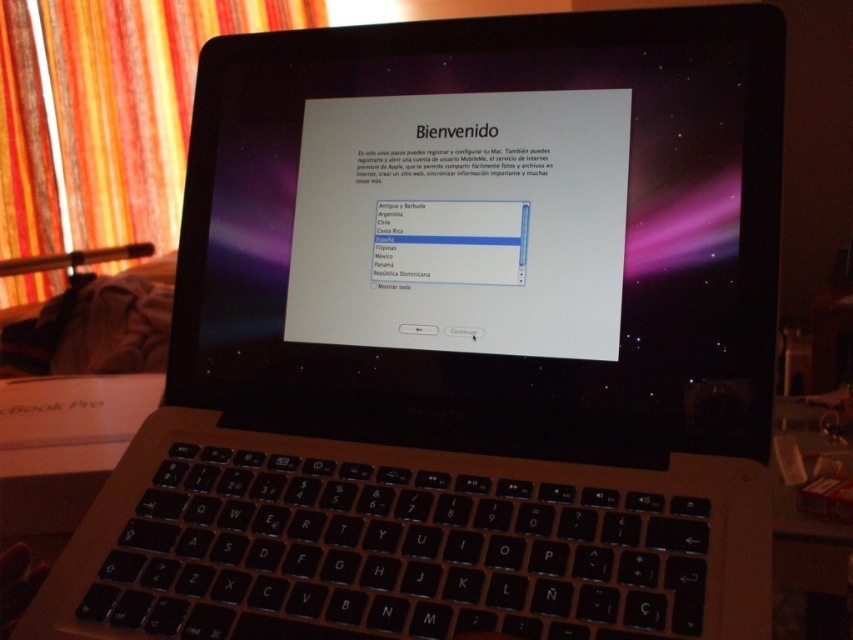
Question: Can you confirm if orange fabric curtain at left is positioned to the left of black plastic keyboard at lower center?

Choices:
 (A) no
 (B) yes

Answer: (B)

Question: Which point is farther to the camera?

Choices:
 (A) (131, 216)
 (B) (132, 404)

Answer: (A)

Question: Is orange fabric curtain at left below black plastic keyboard at lower center?

Choices:
 (A) yes
 (B) no

Answer: (B)

Question: Is orange fabric curtain at left positioned in front of black plastic keyboard at lower center?

Choices:
 (A) yes
 (B) no

Answer: (B)